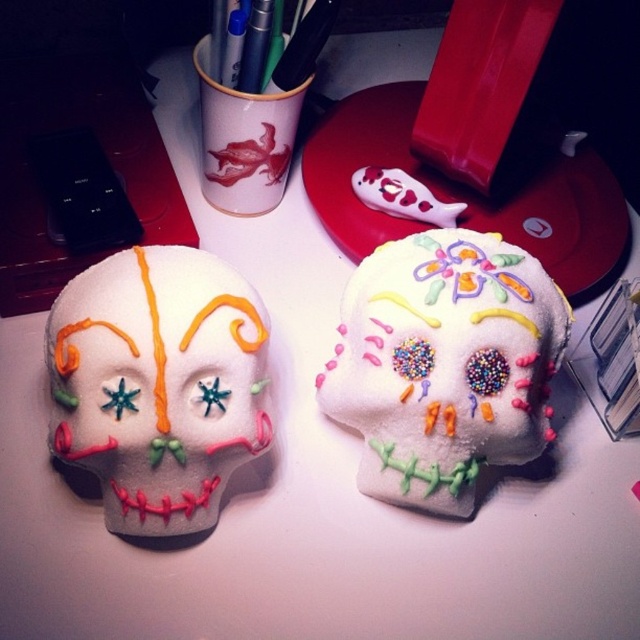
Is matte sugar skull at center to the right of green matte pen at upper center from the viewer's perspective?

No, matte sugar skull at center is not to the right of green matte pen at upper center.

Is matte sugar skull at center above green matte pen at upper center?

No, matte sugar skull at center is not above green matte pen at upper center.

Is point (72, 348) positioned after point (285, 49)?

That is False.

At what (x,y) coordinates should I click in order to perform the action: click on matte sugar skull at center. Please return your answer as a coordinate pair (x, y). This screenshot has width=640, height=640. Looking at the image, I should click on (157, 385).

Is sugary white skull at center taller than green matte pen at upper center?

Correct, sugary white skull at center is much taller as green matte pen at upper center.

Does sugary white skull at center appear on the left side of green matte pen at upper center?

No, sugary white skull at center is not to the left of green matte pen at upper center.

Is point (372, 394) in front of point (305, 19)?

Yes.

You are a GUI agent. You are given a task and a screenshot of the screen. Output one action in this format:
    pyautogui.click(x=<x>, y=<y>)
    Task: Click on the sugary white skull at center
    The width and height of the screenshot is (640, 640).
    Given the screenshot: What is the action you would take?
    point(444,364)

Is sugary white skull at center further to camera compared to matte sugar skull at center?

Yes, it is.

Is sugary white skull at center positioned before matte sugar skull at center?

No, it is not.

At what (x,y) coordinates should I click in order to perform the action: click on sugary white skull at center. Please return your answer as a coordinate pair (x, y). Looking at the image, I should click on (444, 364).